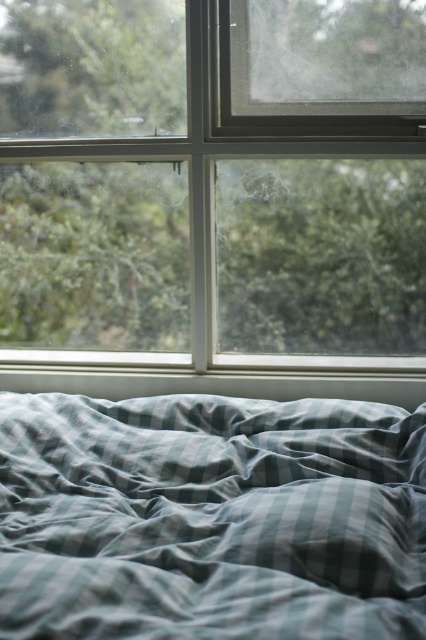
Question: Is clear glass window at upper center in front of green striped fabric at lower center?

Choices:
 (A) yes
 (B) no

Answer: (B)

Question: Does clear glass window at upper center have a smaller size compared to green striped fabric at lower center?

Choices:
 (A) no
 (B) yes

Answer: (A)

Question: Which point is farther to the camera?

Choices:
 (A) (400, 124)
 (B) (192, 570)

Answer: (A)

Question: Does clear glass window at upper center have a lesser width compared to green striped fabric at lower center?

Choices:
 (A) no
 (B) yes

Answer: (A)